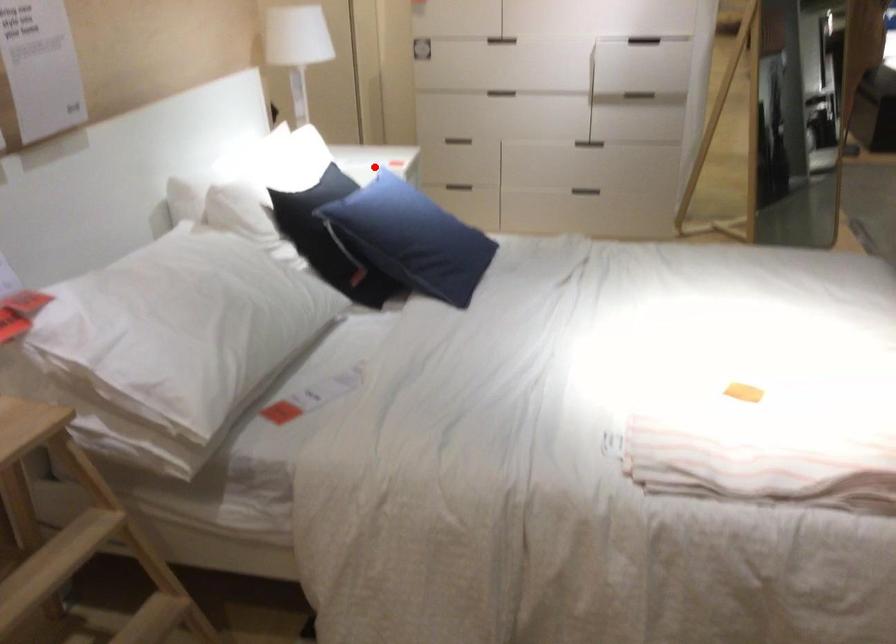
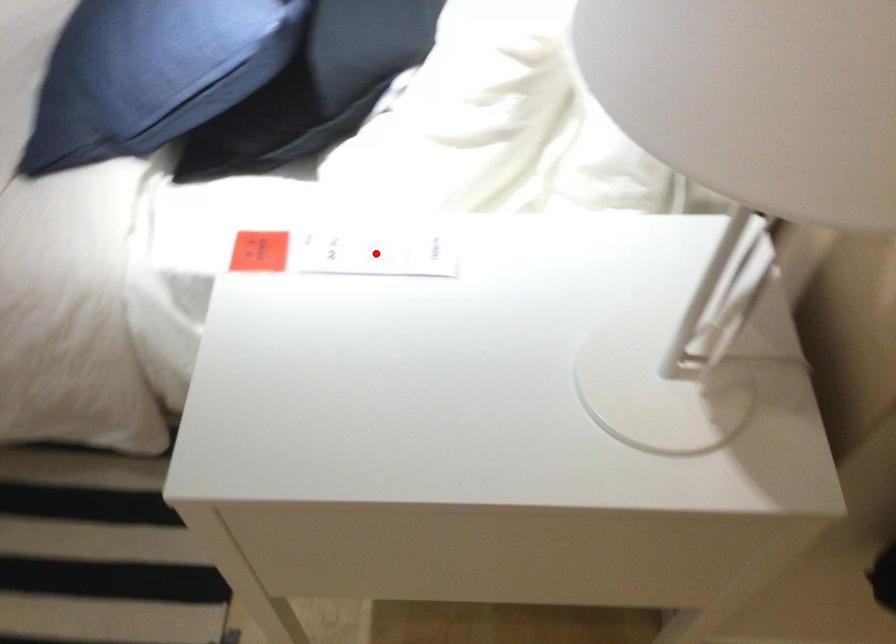
Looking at this image, I am providing you with two images of the same scene from different viewpoints. A red point is marked on the first image and another point is marked on the second image. Is the red point in image1 aligned with the point shown in image2?

Yes